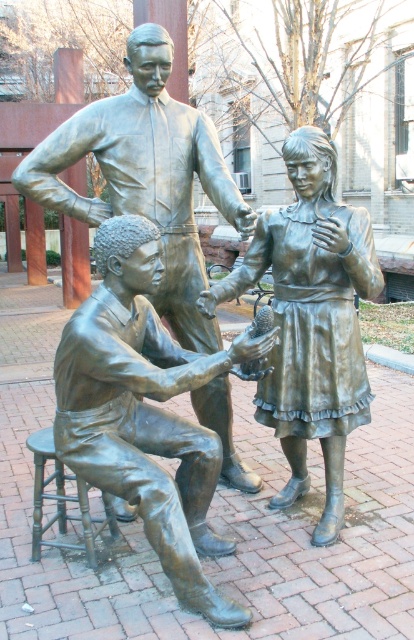
You are an art curator planning to move the bronze statue at center and the bronze stool at lower left into a new exhibition space. The entrance to the space is narrow, and you need to know which object is wider to ensure proper transport. Based on the scene description, which object is wider?

The bronze statue at center is wider than the bronze stool at lower left according to the description.

You are a visitor at the sculpture garden and want to take a photo of the bronze statue at lower left and the bronze stool at lower left. Since you want both objects to be clearly visible in the frame, do you need to adjust your camera angle to accommodate their widths?

The bronze statue at lower left is wider than the bronze stool at lower left, so you might need to adjust your camera angle to ensure both are fully visible in the frame.